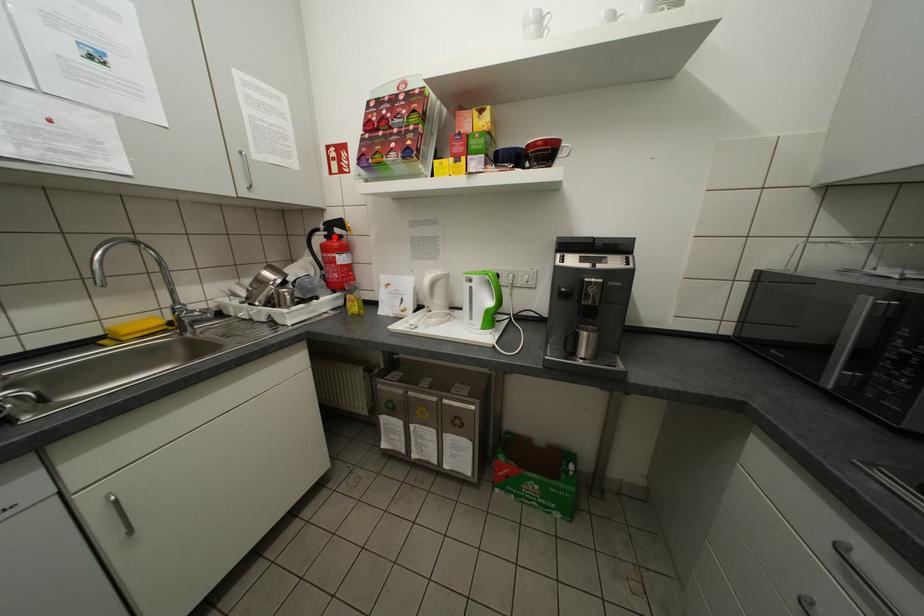
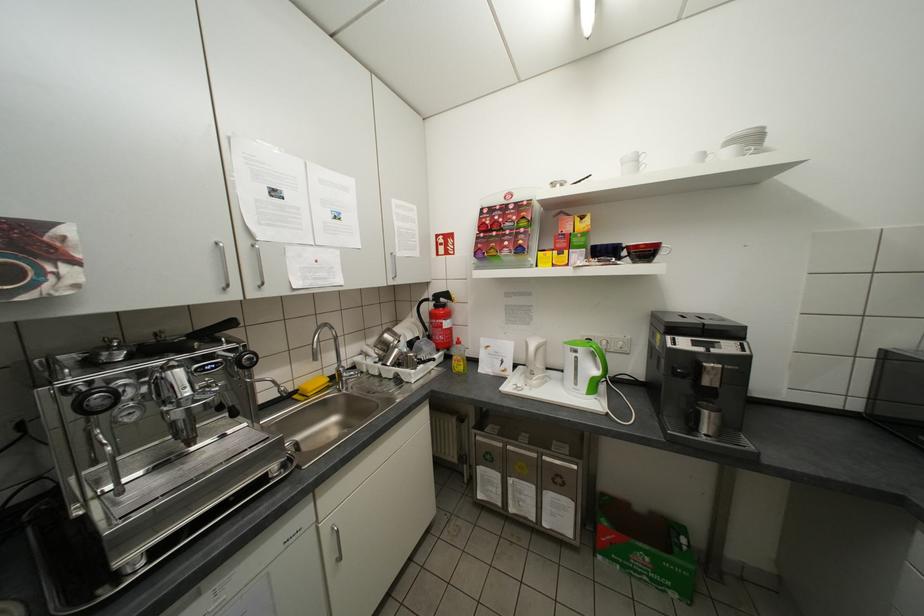
In the second image, find the point that corresponds to the highlighted location in the first image.

(444, 306)